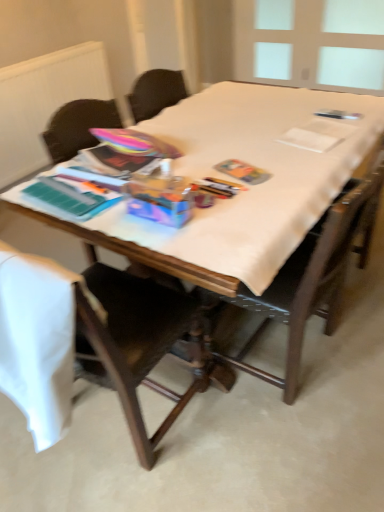
Question: Is wooden chair at left, the first chair when ordered from left to right, behind transparent plastic window screen at upper right?

Choices:
 (A) yes
 (B) no

Answer: (B)

Question: Is wooden chair at left, the first chair when ordered from left to right, to the right of transparent plastic window screen at upper right from the viewer's perspective?

Choices:
 (A) yes
 (B) no

Answer: (B)

Question: From a real-world perspective, is wooden chair at left, which is the 2th chair in right-to-left order, on top of transparent plastic window screen at upper right?

Choices:
 (A) no
 (B) yes

Answer: (A)

Question: Is wooden chair at left, the first chair when ordered from left to right, shorter than transparent plastic window screen at upper right?

Choices:
 (A) no
 (B) yes

Answer: (A)

Question: Is wooden chair at left, the first chair when ordered from left to right, smaller than transparent plastic window screen at upper right?

Choices:
 (A) no
 (B) yes

Answer: (A)

Question: Would you say wooden chair at left, the first chair when ordered from left to right, contains transparent plastic window screen at upper right?

Choices:
 (A) yes
 (B) no

Answer: (B)

Question: Considering the relative sizes of transparent plastic window screen at upper right and wooden chair at center, placed as the 2th chair when sorted from left to right, in the image provided, is transparent plastic window screen at upper right taller than wooden chair at center, placed as the 2th chair when sorted from left to right,?

Choices:
 (A) no
 (B) yes

Answer: (A)

Question: From a real-world perspective, is transparent plastic window screen at upper right below wooden chair at center, placed as the 1th chair when sorted from right to left?

Choices:
 (A) no
 (B) yes

Answer: (A)

Question: Considering the relative sizes of transparent plastic window screen at upper right and wooden chair at center, placed as the 1th chair when sorted from right to left, in the image provided, is transparent plastic window screen at upper right shorter than wooden chair at center, placed as the 1th chair when sorted from right to left,?

Choices:
 (A) yes
 (B) no

Answer: (A)

Question: Is transparent plastic window screen at upper right at the left side of wooden chair at center, placed as the 1th chair when sorted from right to left?

Choices:
 (A) yes
 (B) no

Answer: (B)

Question: Is transparent plastic window screen at upper right positioned beyond the bounds of wooden chair at center, placed as the 1th chair when sorted from right to left?

Choices:
 (A) yes
 (B) no

Answer: (A)

Question: Is transparent plastic window screen at upper right oriented towards wooden chair at center, placed as the 1th chair when sorted from right to left?

Choices:
 (A) no
 (B) yes

Answer: (B)

Question: From a real-world perspective, is wooden chair at left, which is the 2th chair in right-to-left order, on wooden chair at center, placed as the 2th chair when sorted from left to right?

Choices:
 (A) no
 (B) yes

Answer: (A)